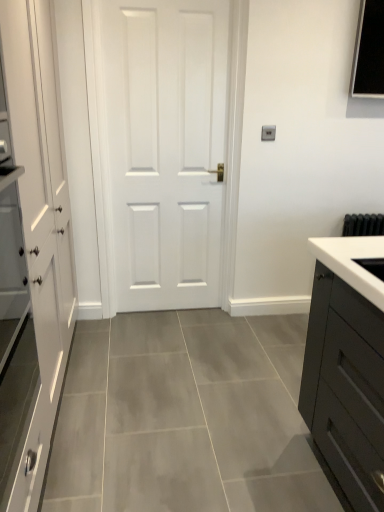
Question: Does white matte door at center have a greater width compared to white matte cabinet at left?

Choices:
 (A) no
 (B) yes

Answer: (A)

Question: Could you tell me if white matte door at center is turned towards white matte cabinet at left?

Choices:
 (A) no
 (B) yes

Answer: (A)

Question: Does white matte door at center appear on the left side of white matte cabinet at left?

Choices:
 (A) yes
 (B) no

Answer: (B)

Question: Is white matte cabinet at left surrounded by white matte door at center?

Choices:
 (A) yes
 (B) no

Answer: (B)

Question: Is white matte door at center positioned beyond the bounds of white matte cabinet at left?

Choices:
 (A) yes
 (B) no

Answer: (A)

Question: Considering the positions of white matte door at center and white matte cabinet at left in the image, is white matte door at center bigger or smaller than white matte cabinet at left?

Choices:
 (A) big
 (B) small

Answer: (B)

Question: From a real-world perspective, relative to white matte cabinet at left, is white matte door at center vertically above or below?

Choices:
 (A) above
 (B) below

Answer: (A)

Question: Considering the positions of white matte door at center and white matte cabinet at left in the image, is white matte door at center taller or shorter than white matte cabinet at left?

Choices:
 (A) tall
 (B) short

Answer: (A)

Question: Is point (158, 58) closer or farther from the camera than point (43, 301)?

Choices:
 (A) closer
 (B) farther

Answer: (B)

Question: From their relative heights in the image, would you say white matte cabinet at left is taller or shorter than white matte door at center?

Choices:
 (A) tall
 (B) short

Answer: (B)

Question: Based on their sizes in the image, would you say white matte cabinet at left is bigger or smaller than white matte door at center?

Choices:
 (A) small
 (B) big

Answer: (B)

Question: Looking at their shapes, would you say white matte cabinet at left is wider or thinner than white matte door at center?

Choices:
 (A) wide
 (B) thin

Answer: (A)

Question: Would you say white matte cabinet at left is inside or outside white matte door at center?

Choices:
 (A) inside
 (B) outside

Answer: (B)

Question: Does point (364, 295) appear closer or farther from the camera than point (26, 8)?

Choices:
 (A) closer
 (B) farther

Answer: (A)

Question: Considering the relative positions of white glossy sink at right and white matte cabinet at left in the image provided, is white glossy sink at right to the left or to the right of white matte cabinet at left?

Choices:
 (A) left
 (B) right

Answer: (B)